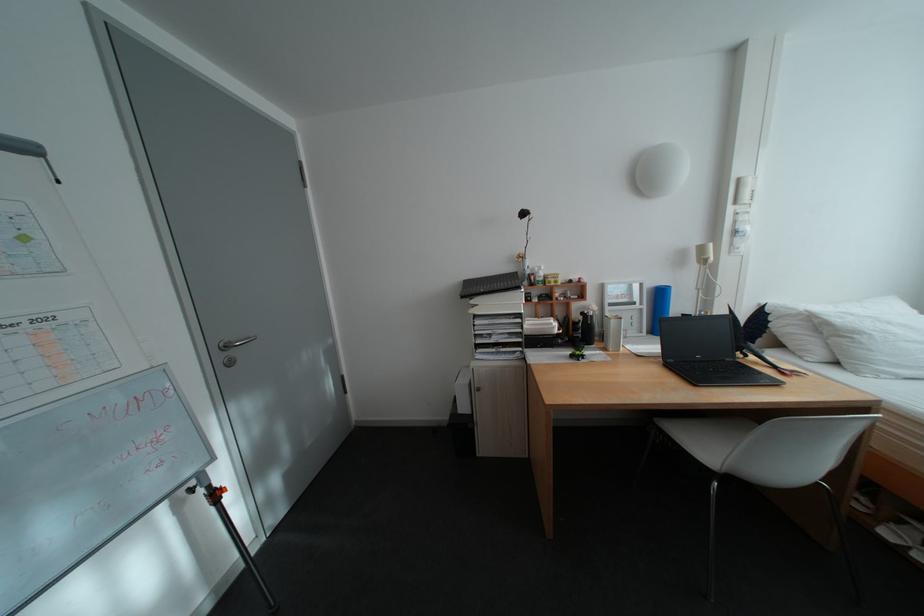
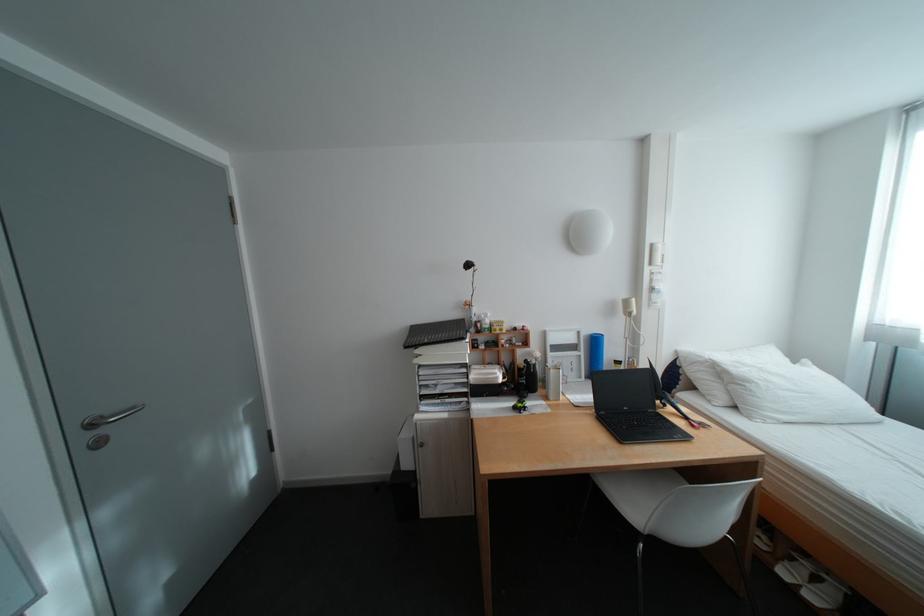
Find the pixel in the second image that matches (x=871, y=334) in the first image.

(761, 384)